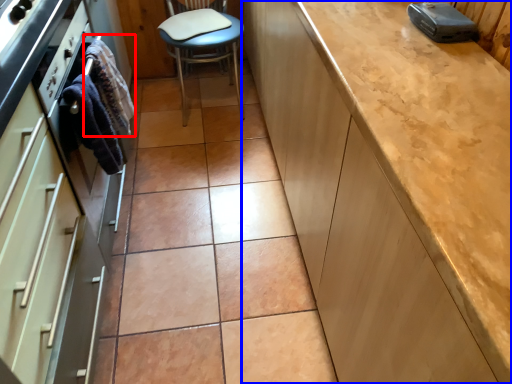
Question: Which object is closer to the camera taking this photo, material (highlighted by a red box) or cabinetry (highlighted by a blue box)?

Choices:
 (A) material
 (B) cabinetry

Answer: (B)